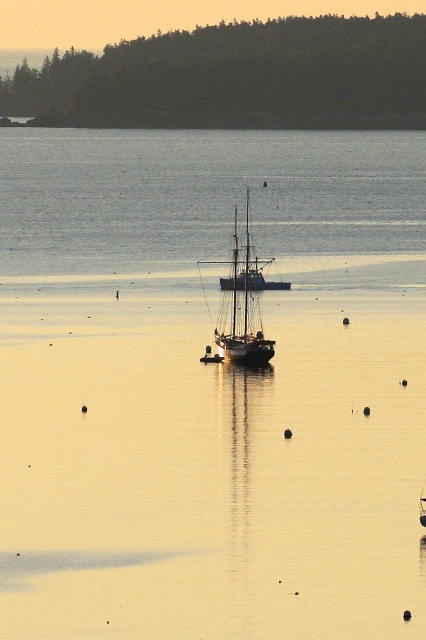
Question: Which object appears closest to the camera in this image?

Choices:
 (A) clear water at center
 (B) wooden sailboat at center

Answer: (B)

Question: Where is clear water at center located in relation to wooden sailboat at center in the image?

Choices:
 (A) right
 (B) left

Answer: (A)

Question: Can you confirm if clear water at center is positioned to the right of wooden sailboat at center?

Choices:
 (A) yes
 (B) no

Answer: (A)

Question: Which object is farther from the camera taking this photo?

Choices:
 (A) clear water at center
 (B) wooden sailboat at center

Answer: (A)

Question: Can you confirm if clear water at center is bigger than wooden sailboat at center?

Choices:
 (A) yes
 (B) no

Answer: (A)